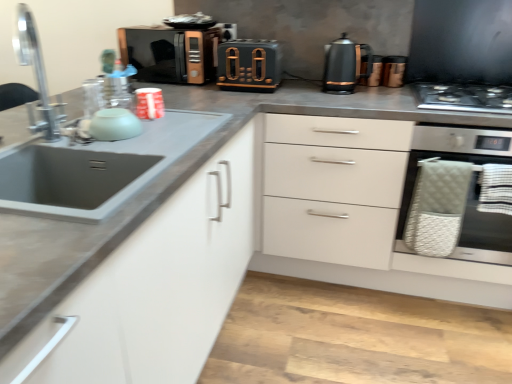
Question: From the image's perspective, is metallic copper kettle at upper right, the second appliance from the back, positioned above or below stainless steel oven at right?

Choices:
 (A) below
 (B) above

Answer: (B)

Question: From a real-world perspective, is metallic copper kettle at upper right, placed as the first appliance when sorted from right to left, physically located above or below stainless steel oven at right?

Choices:
 (A) above
 (B) below

Answer: (A)

Question: Based on their relative distances, which object is farther from the quilted fabric basket at lower right?

Choices:
 (A) metallic copper kettle at upper right, the second appliance from the back
 (B) matte black microwave at upper center, the 2th appliance in the left-to-right sequence
 (C) matte green bowl at left, placed as the first appliance when sorted from left to right
 (D) silver metallic faucet at left
 (E) matte black toaster at center, which appears as the 2th appliance when viewed from the front

Answer: (D)

Question: Considering the real-world distances, which object is farthest from the stainless steel oven at right?

Choices:
 (A) matte black kettle at upper right
 (B) white matte cabinet at left
 (C) matte black toaster at center, the 3th appliance when ordered from left to right
 (D) matte black microwave at upper center, the 2th appliance in the left-to-right sequence
 (E) matte green bowl at left, which ranks as the first appliance in front-to-back order

Answer: (E)